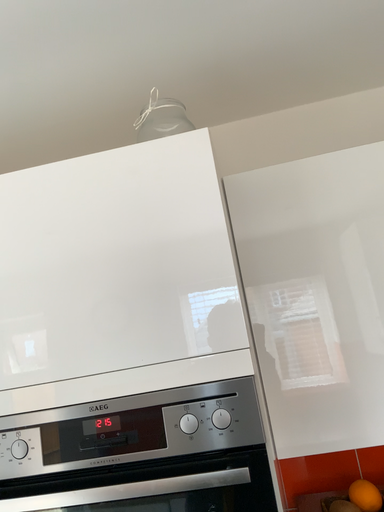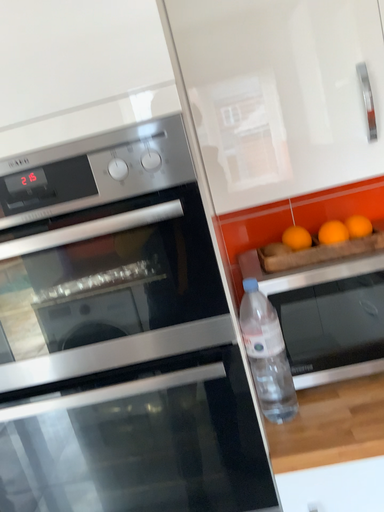
Question: Which way did the camera rotate in the video?

Choices:
 (A) rotated downward
 (B) rotated upward

Answer: (A)